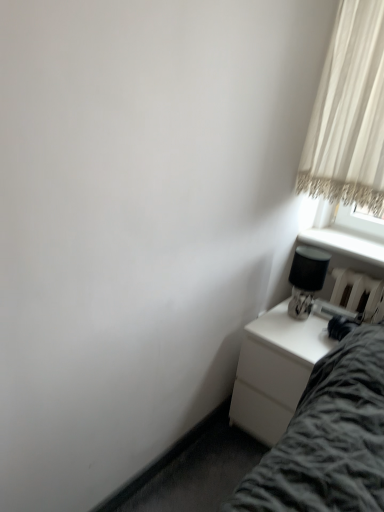
Question: Does black glossy table lamp at right contain white sheer curtain at upper right?

Choices:
 (A) no
 (B) yes

Answer: (A)

Question: Is white sheer curtain at upper right at the back of black glossy table lamp at right?

Choices:
 (A) yes
 (B) no

Answer: (B)

Question: From a real-world perspective, is black glossy table lamp at right under white sheer curtain at upper right?

Choices:
 (A) yes
 (B) no

Answer: (A)

Question: Is the surface of black glossy table lamp at right in direct contact with white sheer curtain at upper right?

Choices:
 (A) yes
 (B) no

Answer: (B)

Question: Considering the relative sizes of black glossy table lamp at right and white sheer curtain at upper right in the image provided, is black glossy table lamp at right bigger than white sheer curtain at upper right?

Choices:
 (A) no
 (B) yes

Answer: (A)

Question: Considering the positions of point (375, 133) and point (306, 352), is point (375, 133) closer or farther from the camera than point (306, 352)?

Choices:
 (A) closer
 (B) farther

Answer: (B)

Question: In terms of height, does white sheer curtain at upper right look taller or shorter compared to white glossy nightstand at lower right?

Choices:
 (A) tall
 (B) short

Answer: (A)

Question: Considering the positions of white sheer curtain at upper right and white glossy nightstand at lower right in the image, is white sheer curtain at upper right wider or thinner than white glossy nightstand at lower right?

Choices:
 (A) thin
 (B) wide

Answer: (A)

Question: From a real-world perspective, is white sheer curtain at upper right positioned above or below white glossy nightstand at lower right?

Choices:
 (A) above
 (B) below

Answer: (A)

Question: Considering the positions of white glossy nightstand at lower right and black glossy table lamp at right in the image, is white glossy nightstand at lower right taller or shorter than black glossy table lamp at right?

Choices:
 (A) short
 (B) tall

Answer: (B)

Question: Considering the positions of white glossy nightstand at lower right and black glossy table lamp at right in the image, is white glossy nightstand at lower right bigger or smaller than black glossy table lamp at right?

Choices:
 (A) small
 (B) big

Answer: (B)

Question: Choose the correct answer: Is white glossy nightstand at lower right inside black glossy table lamp at right or outside it?

Choices:
 (A) outside
 (B) inside

Answer: (A)

Question: Is white glossy nightstand at lower right wider or thinner than black glossy table lamp at right?

Choices:
 (A) thin
 (B) wide

Answer: (B)

Question: From the image's perspective, is white sheer curtain at upper right above or below black glossy table lamp at right?

Choices:
 (A) below
 (B) above

Answer: (B)

Question: Does point (352, 124) appear closer or farther from the camera than point (299, 300)?

Choices:
 (A) farther
 (B) closer

Answer: (B)